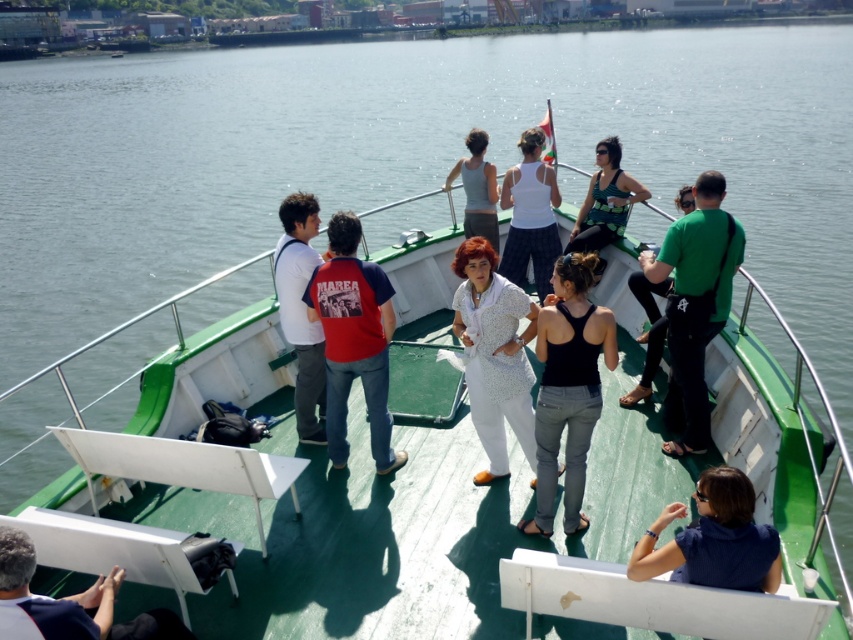
You are a tour guide on the boat and need to move from the dark blue fabric shoe at lower left to the green matte shirt at right. The path between them is clear. Can you walk directly between them without any obstacles?

The distance between the dark blue fabric shoe at lower left and the green matte shirt at right is 14.26 feet, so yes, you can walk directly between them without any obstacles since the path is clear and the distance is manageable.

You are standing on the deck of the boat and notice a dark blue fabric shoe at lower left. If you want to place a small item exactly where the shoe is currently located, which coordinates should you aim for?

The dark blue fabric shoe at lower left is located at point (68, 604), so you should aim for those coordinates.